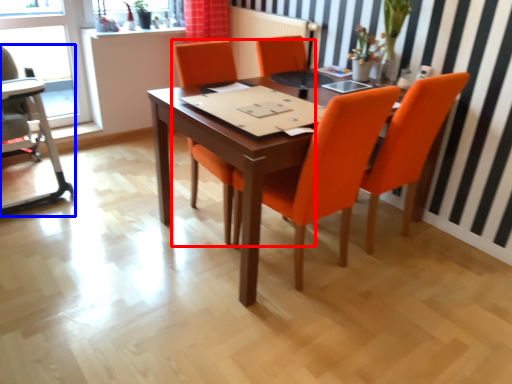
Question: Among these objects, which one is farthest to the camera, chair (highlighted by a red box) or armchair (highlighted by a blue box)?

Choices:
 (A) chair
 (B) armchair

Answer: (B)